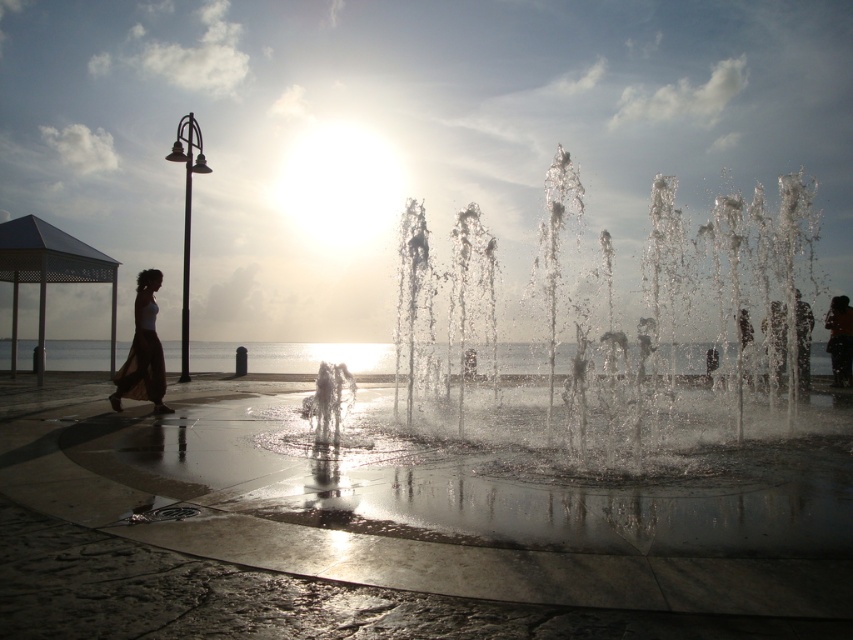
Consider the image. You are standing at the waterfront and see the clear water at center and the silhouette skirt at left. Which object is wider?

The clear water at center is wider than the silhouette skirt at left.

Based on the scene description, where is the clear water at center located in the image?

The clear water at center is located at point coordinates of (318, 356).